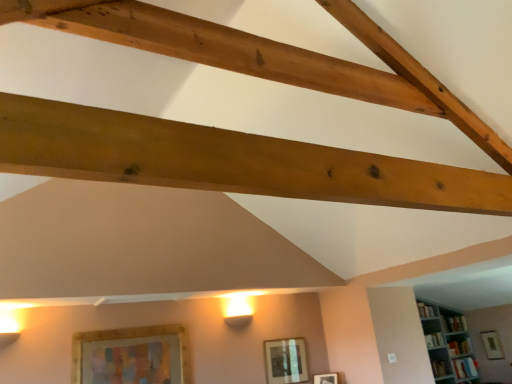
Question: Is matte silver picture frame at center, which is the 3th picture frame from right to left, not inside natural wood beam at upper center?

Choices:
 (A) yes
 (B) no

Answer: (A)

Question: Does matte silver picture frame at center, the 2th picture frame when ordered from front to back, touch natural wood beam at upper center?

Choices:
 (A) no
 (B) yes

Answer: (A)

Question: Is matte silver picture frame at center, positioned as the 2th picture frame in left-to-right order, to the right of natural wood beam at upper center from the viewer's perspective?

Choices:
 (A) yes
 (B) no

Answer: (B)

Question: Is matte silver picture frame at center, acting as the 3th picture frame starting from the back, turned away from natural wood beam at upper center?

Choices:
 (A) yes
 (B) no

Answer: (B)

Question: Considering the relative sizes of matte silver picture frame at center, the 2th picture frame when ordered from front to back, and natural wood beam at upper center in the image provided, is matte silver picture frame at center, the 2th picture frame when ordered from front to back, smaller than natural wood beam at upper center?

Choices:
 (A) yes
 (B) no

Answer: (A)

Question: Considering the relative sizes of matte silver picture frame at center, the 2th picture frame when ordered from front to back, and natural wood beam at upper center in the image provided, is matte silver picture frame at center, the 2th picture frame when ordered from front to back, shorter than natural wood beam at upper center?

Choices:
 (A) yes
 (B) no

Answer: (A)

Question: Can you confirm if wooden framed picture at lower left, the 4th picture frame from the bottom, is shorter than matte silver picture frame at center, the 3th picture frame when ordered from bottom to top?

Choices:
 (A) yes
 (B) no

Answer: (B)

Question: From a real-world perspective, does wooden framed picture at lower left, the 4th picture frame from the bottom, sit lower than matte silver picture frame at center, positioned as the 2th picture frame in left-to-right order?

Choices:
 (A) yes
 (B) no

Answer: (B)

Question: Does wooden framed picture at lower left, which is the first picture frame from left to right, lie behind matte silver picture frame at center, positioned as the 2th picture frame in left-to-right order?

Choices:
 (A) no
 (B) yes

Answer: (A)

Question: Is wooden framed picture at lower left, acting as the first picture frame starting from the top, looking in the opposite direction of matte silver picture frame at center, the 2th picture frame when ordered from front to back?

Choices:
 (A) yes
 (B) no

Answer: (B)

Question: From a real-world perspective, is wooden framed picture at lower left, the fourth picture frame positioned from the right, positioned over matte silver picture frame at center, which is counted as the 2th picture frame, starting from the top, based on gravity?

Choices:
 (A) yes
 (B) no

Answer: (A)

Question: Is wooden framed picture at lower left, which is the first picture frame from left to right, positioned in front of matte silver picture frame at center, positioned as the 2th picture frame in left-to-right order?

Choices:
 (A) yes
 (B) no

Answer: (A)

Question: Does white wooden bookshelf at upper right have a greater width compared to matte silver picture frame at center, acting as the 3th picture frame starting from the back?

Choices:
 (A) no
 (B) yes

Answer: (B)